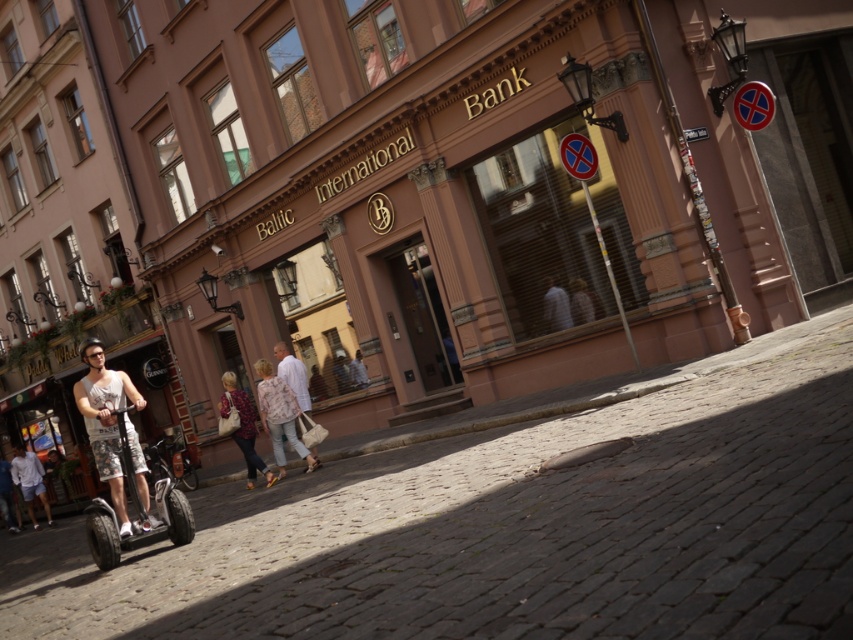
Does cobblestone pavement at lower center appear under white cotton shorts at lower left?

Actually, cobblestone pavement at lower center is above white cotton shorts at lower left.

Between cobblestone pavement at lower center and white cotton shorts at lower left, which one is positioned higher?

Positioned higher is cobblestone pavement at lower center.

What do you see at coordinates (514, 528) in the screenshot?
I see `cobblestone pavement at lower center` at bounding box center [514, 528].

Where is `cobblestone pavement at lower center`? The width and height of the screenshot is (853, 640). cobblestone pavement at lower center is located at coordinates (514, 528).

Is white cotton tank top at center above light gray shirt at center?

No, white cotton tank top at center is not above light gray shirt at center.

Which is behind, point (99, 422) or point (547, 291)?

Positioned behind is point (547, 291).

You are a GUI agent. You are given a task and a screenshot of the screen. Output one action in this format:
    pyautogui.click(x=<x>, y=<y>)
    Task: Click on the white cotton tank top at center
    
    Given the screenshot: What is the action you would take?
    pyautogui.click(x=105, y=419)

In the scene shown: Does white cotton tank top at center appear on the left side of white cotton shorts at lower left?

No, white cotton tank top at center is not to the left of white cotton shorts at lower left.

Looking at this image, does white cotton tank top at center appear on the right side of white cotton shorts at lower left?

Yes, white cotton tank top at center is to the right of white cotton shorts at lower left.

This screenshot has height=640, width=853. Find the location of `white cotton tank top at center`. white cotton tank top at center is located at coordinates (105, 419).

You are a GUI agent. You are given a task and a screenshot of the screen. Output one action in this format:
    pyautogui.click(x=<x>, y=<y>)
    Task: Click on the white cotton tank top at center
    The width and height of the screenshot is (853, 640).
    Given the screenshot: What is the action you would take?
    pyautogui.click(x=105, y=419)